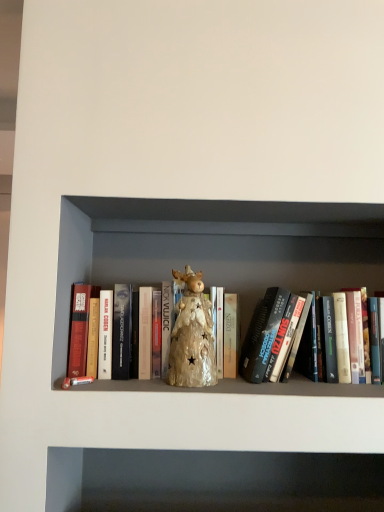
Question: Based on their positions, is iridescent ceramic reindeer at center located to the left or right of matte gold statue at center?

Choices:
 (A) left
 (B) right

Answer: (A)

Question: From a real-world perspective, is iridescent ceramic reindeer at center physically located above or below matte gold statue at center?

Choices:
 (A) below
 (B) above

Answer: (A)

Question: Which is correct: iridescent ceramic reindeer at center is inside matte gold statue at center, or outside of it?

Choices:
 (A) outside
 (B) inside

Answer: (B)

Question: From a real-world perspective, is matte gold statue at center above or below iridescent ceramic reindeer at center?

Choices:
 (A) below
 (B) above

Answer: (B)

Question: In terms of size, does matte gold statue at center appear bigger or smaller than iridescent ceramic reindeer at center?

Choices:
 (A) small
 (B) big

Answer: (B)

Question: From their relative heights in the image, would you say matte gold statue at center is taller or shorter than iridescent ceramic reindeer at center?

Choices:
 (A) tall
 (B) short

Answer: (A)

Question: Which is correct: matte gold statue at center is inside iridescent ceramic reindeer at center, or outside of it?

Choices:
 (A) outside
 (B) inside

Answer: (A)